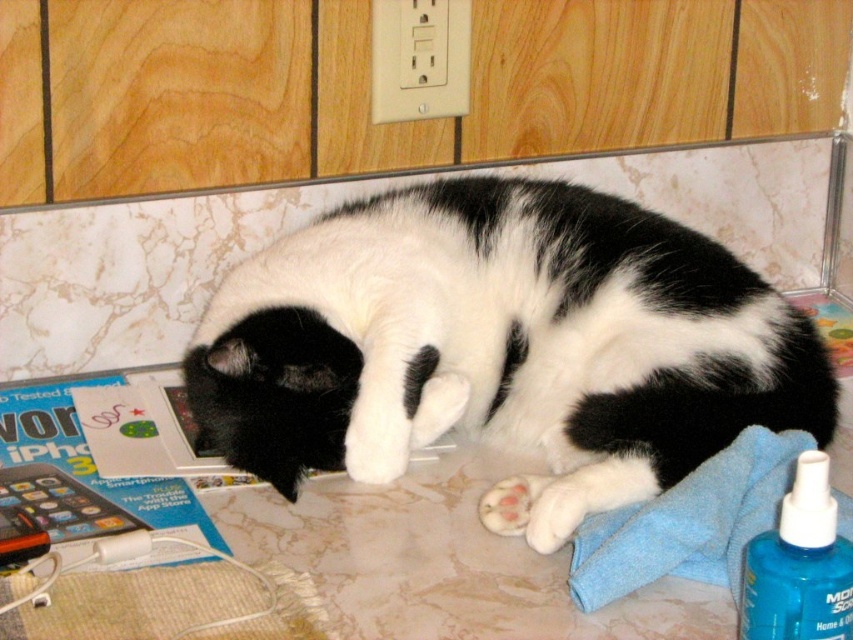
Question: Is black and white fur cat at center bigger than white fluffy paw at lower center?

Choices:
 (A) yes
 (B) no

Answer: (A)

Question: Is black and white fur cat at center positioned behind white soft paw at lower center?

Choices:
 (A) yes
 (B) no

Answer: (A)

Question: Considering the real-world distances, which object is farthest from the black and white fur cat at center?

Choices:
 (A) white fluffy paw at lower center
 (B) blue plastic spray bottle at lower right

Answer: (B)

Question: Which point is closer to the camera?

Choices:
 (A) (453, 426)
 (B) (537, 522)
 (C) (772, 596)
 (D) (502, 481)

Answer: (C)

Question: Estimate the real-world distances between objects in this image. Which object is closer to the white soft paw at lower center?

Choices:
 (A) black and white fur cat at center
 (B) white fluffy paw at lower center
 (C) blue plastic spray bottle at lower right

Answer: (B)

Question: Does blue plastic spray bottle at lower right come in front of white soft paw at lower center?

Choices:
 (A) yes
 (B) no

Answer: (A)